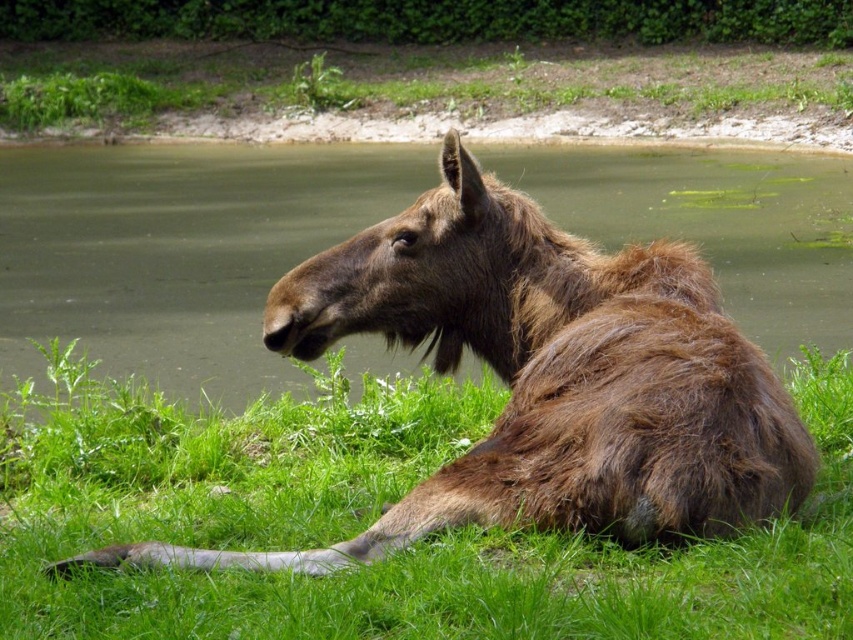
Question: Estimate the real-world distances between objects in this image. Which object is closer to the brown furry moose at center?

Choices:
 (A) green grass at upper center
 (B) green soft grass at lower center

Answer: (B)

Question: Does green soft grass at lower center appear under green grass at upper center?

Choices:
 (A) yes
 (B) no

Answer: (A)

Question: Which point is farther to the camera?

Choices:
 (A) (664, 508)
 (B) (368, 464)

Answer: (B)

Question: Which point is farther to the camera?

Choices:
 (A) (152, 589)
 (B) (576, 93)

Answer: (B)

Question: In this image, where is green soft grass at lower center located relative to green grass at upper center?

Choices:
 (A) above
 (B) below

Answer: (B)

Question: Can you confirm if green soft grass at lower center is positioned to the left of brown furry moose at center?

Choices:
 (A) no
 (B) yes

Answer: (B)